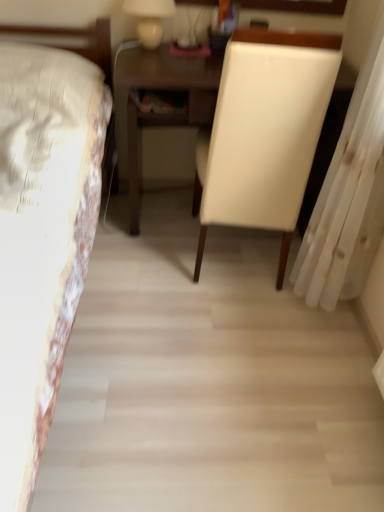
Identify the location of free point below white sheer curtain at right (from a real-world perspective). This screenshot has width=384, height=512. (326, 328).